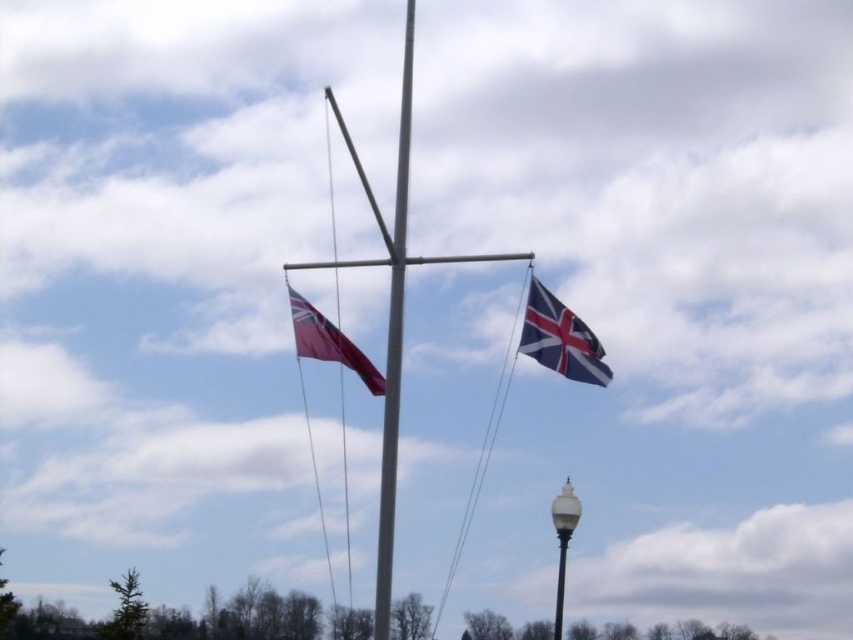
Is point (402, 124) positioned behind point (531, 282)?

Yes, it is behind point (531, 282).

Who is more distant from viewer, (399, 172) or (558, 337)?

The point (558, 337) is behind.

The height and width of the screenshot is (640, 853). Find the location of `metallic silver flag pole at center`. metallic silver flag pole at center is located at coordinates (393, 346).

Who is more forward, (331, 262) or (563, 486)?

Positioned in front is point (331, 262).

Between metallic pole at center and white glossy lamp post at center, which one appears on the right side from the viewer's perspective?

Positioned to the right is white glossy lamp post at center.

The width and height of the screenshot is (853, 640). Find the location of `metallic pole at center`. metallic pole at center is located at coordinates (393, 316).

Who is positioned more to the right, metallic pole at center or red matte flag at center?

Positioned to the right is metallic pole at center.

Does metallic pole at center lie in front of red matte flag at center?

Yes, it is in front of red matte flag at center.

Find the location of `metallic pole at center`. metallic pole at center is located at coordinates (393, 316).

The height and width of the screenshot is (640, 853). Find the location of `metallic pole at center`. metallic pole at center is located at coordinates (393, 316).